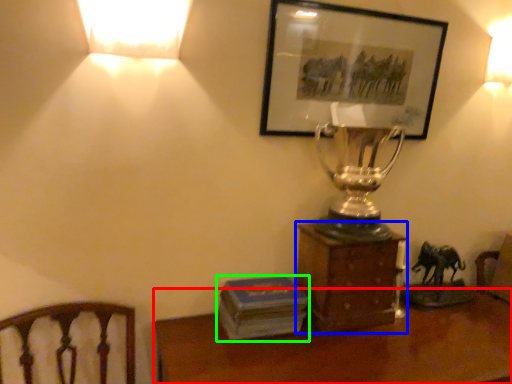
Question: Which object is the farthest from desk (highlighted by a red box)? Choose among these: furniture (highlighted by a blue box) or paperback book (highlighted by a green box).

Choices:
 (A) furniture
 (B) paperback book

Answer: (A)